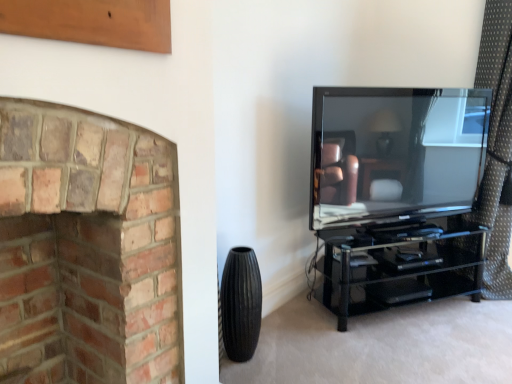
Where is `vacant area that is in front of black ribbed vase at lower center`? vacant area that is in front of black ribbed vase at lower center is located at coordinates (x=248, y=376).